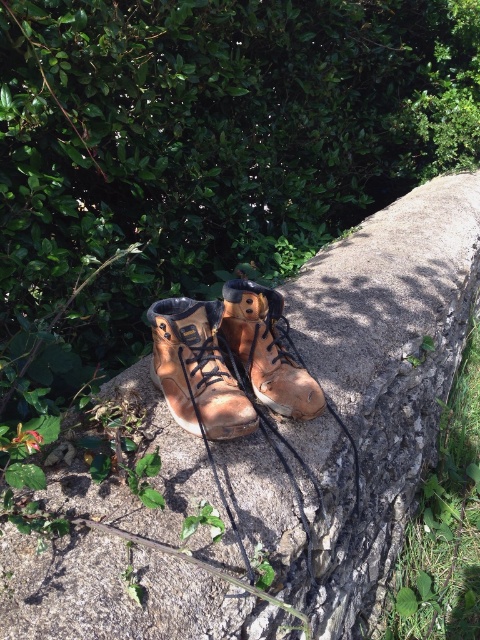
Consider the image. You are standing in a forest clearing and notice a rusty concrete wall at center and a brown leather boot at center. Which object is positioned lower in the scene?

The rusty concrete wall at center is positioned lower than the brown leather boot at center in the scene.

You are standing in an outdoor area with a rough stone surface and dense green foliage in the background. You see a pair of worn brown hiking boots placed on the stone surface. There is a specific point at coordinates (196, 369). Based on the scene, can you determine what object this point is located on?

The point at coordinates (196, 369) is located on the leather boot at center.